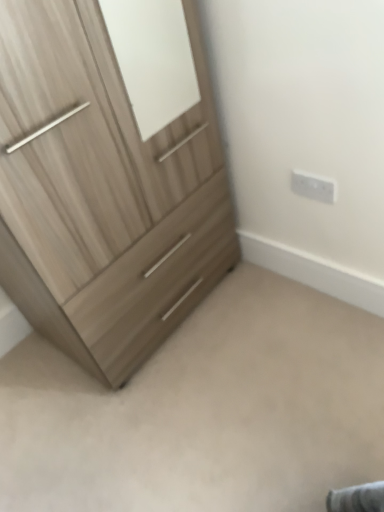
Question: Does white plastic electric outlet at upper right turn towards light wood/texture chest of drawers at left?

Choices:
 (A) no
 (B) yes

Answer: (A)

Question: From a real-world perspective, is white plastic electric outlet at upper right physically below light wood/texture chest of drawers at left?

Choices:
 (A) no
 (B) yes

Answer: (B)

Question: Is white plastic electric outlet at upper right further to camera compared to light wood/texture chest of drawers at left?

Choices:
 (A) yes
 (B) no

Answer: (A)

Question: Is white plastic electric outlet at upper right shorter than light wood/texture chest of drawers at left?

Choices:
 (A) no
 (B) yes

Answer: (B)

Question: Is white plastic electric outlet at upper right outside light wood/texture chest of drawers at left?

Choices:
 (A) no
 (B) yes

Answer: (B)

Question: In terms of width, does light wood dresser at lower left look wider or thinner when compared to light wood/texture chest of drawers at left?

Choices:
 (A) wide
 (B) thin

Answer: (A)

Question: Is light wood dresser at lower left taller or shorter than light wood/texture chest of drawers at left?

Choices:
 (A) tall
 (B) short

Answer: (B)

Question: From the image's perspective, is light wood dresser at lower left positioned above or below light wood/texture chest of drawers at left?

Choices:
 (A) above
 (B) below

Answer: (B)

Question: Visually, is light wood dresser at lower left positioned to the left or to the right of light wood/texture chest of drawers at left?

Choices:
 (A) left
 (B) right

Answer: (B)

Question: Would you say white plastic electric outlet at upper right is to the left or to the right of light wood dresser at lower left in the picture?

Choices:
 (A) left
 (B) right

Answer: (B)

Question: Is white plastic electric outlet at upper right in front of or behind light wood dresser at lower left in the image?

Choices:
 (A) behind
 (B) front

Answer: (A)

Question: From the image's perspective, is white plastic electric outlet at upper right positioned above or below light wood dresser at lower left?

Choices:
 (A) below
 (B) above

Answer: (B)

Question: In terms of height, does white plastic electric outlet at upper right look taller or shorter compared to light wood dresser at lower left?

Choices:
 (A) short
 (B) tall

Answer: (B)

Question: Would you say light wood dresser at lower left is to the left or to the right of white plastic electric outlet at upper right in the picture?

Choices:
 (A) left
 (B) right

Answer: (A)

Question: Is light wood dresser at lower left inside or outside of white plastic electric outlet at upper right?

Choices:
 (A) inside
 (B) outside

Answer: (B)